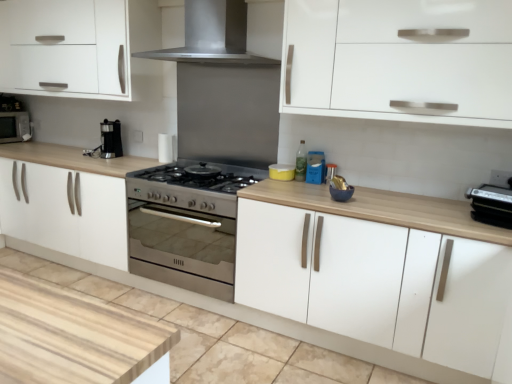
I want to click on metallic silver toaster at center, the 2th appliance positioned from the right, so click(x=330, y=172).

Describe the element at coordinates (330, 172) in the screenshot. I see `metallic silver toaster at center, which ranks as the 2th appliance in back-to-front order` at that location.

Measure the distance between white matte cabinet at lower center, arranged as the 2th cabinetry when viewed from the right, and camera.

A distance of 1.99 meters exists between white matte cabinet at lower center, arranged as the 2th cabinetry when viewed from the right, and camera.

This screenshot has height=384, width=512. What do you see at coordinates (492, 204) in the screenshot?
I see `black plastic toaster at right, positioned as the third appliance in left-to-right order` at bounding box center [492, 204].

Identify the location of white matte cabinet at center, which is the 2th cabinetry in left-to-right order. (377, 283).

Can we say metallic silver toaster at center, the 2th appliance positioned from the right, lies outside white matte cabinet at lower center, the 1th cabinetry from the left?

Yes, metallic silver toaster at center, the 2th appliance positioned from the right, is located beyond the bounds of white matte cabinet at lower center, the 1th cabinetry from the left.

Would you say metallic silver toaster at center, which is the second appliance from left to right, is a long distance from white matte cabinet at lower center, arranged as the 2th cabinetry when viewed from the right?

No, metallic silver toaster at center, which is the second appliance from left to right, is not far away from white matte cabinet at lower center, arranged as the 2th cabinetry when viewed from the right.

Is metallic silver toaster at center, which is the second appliance from left to right, taller or shorter than white matte cabinet at lower center, the 1th cabinetry from the left?

Clearly, metallic silver toaster at center, which is the second appliance from left to right, is taller compared to white matte cabinet at lower center, the 1th cabinetry from the left.

How many degrees apart are the facing directions of stainless steel range hood at upper center and black plastic toaster at right, positioned as the third appliance in left-to-right order?

They differ by 16.1 degrees in their facing directions.

Is point (146, 56) behind point (494, 221)?

Yes, point (146, 56) is behind point (494, 221).

Which of these two, stainless steel range hood at upper center or black plastic toaster at right, placed as the third appliance when sorted from back to front, stands taller?

With more height is stainless steel range hood at upper center.

Do you think stainless steel range hood at upper center is within black plastic toaster at right, positioned as the third appliance in left-to-right order, or outside of it?

The correct answer is: outside.

Between matte black microwave at left and stainless steel range hood at upper center, which one appears on the right side from the viewer's perspective?

From the viewer's perspective, stainless steel range hood at upper center appears more on the right side.

Considering the positions of objects matte black microwave at left and stainless steel range hood at upper center in the image provided, who is in front, matte black microwave at left or stainless steel range hood at upper center?

stainless steel range hood at upper center is more forward.

Considering the relative sizes of matte black microwave at left and stainless steel range hood at upper center in the image provided, is matte black microwave at left wider than stainless steel range hood at upper center?

No, matte black microwave at left is not wider than stainless steel range hood at upper center.

From a real-world perspective, which is physically above, matte black microwave at left or stainless steel range hood at upper center?

stainless steel range hood at upper center.

Is white matte cabinet at center, which is the 2th cabinetry in left-to-right order, located within matte black microwave at left?

That's incorrect, white matte cabinet at center, which is the 2th cabinetry in left-to-right order, is not inside matte black microwave at left.

Locate an element on the screen. This screenshot has height=384, width=512. microwave that is behind the white matte cabinet at center, which is the 2th cabinetry in left-to-right order is located at coordinates (14, 127).

Considering the relative sizes of matte black microwave at left and white matte cabinet at center, the first cabinetry positioned from the right, in the image provided, is matte black microwave at left smaller than white matte cabinet at center, the first cabinetry positioned from the right,?

Correct, matte black microwave at left occupies less space than white matte cabinet at center, the first cabinetry positioned from the right.

Is yellow matte container at center, which is the 1th appliance from back to front, far away from white matte cabinet at lower center, the 1th cabinetry from the left?

No, there isn't a large distance between yellow matte container at center, which is the 1th appliance from back to front, and white matte cabinet at lower center, the 1th cabinetry from the left.

From the picture: Is yellow matte container at center, the 3th appliance positioned from the front, at the right side of white matte cabinet at lower center, arranged as the 2th cabinetry when viewed from the right?

Yes, yellow matte container at center, the 3th appliance positioned from the front, is to the right of white matte cabinet at lower center, arranged as the 2th cabinetry when viewed from the right.

The width and height of the screenshot is (512, 384). In order to click on cabinetry on the left side of yellow matte container at center, marked as the 1th appliance in a left-to-right arrangement in this screenshot , I will do `click(282, 322)`.

Does black plastic toaster at right, which is the first appliance in right-to-left order, contain white matte cabinet at center, which is the 2th cabinetry in left-to-right order?

No, white matte cabinet at center, which is the 2th cabinetry in left-to-right order, is located outside of black plastic toaster at right, which is the first appliance in right-to-left order.

From the image's perspective, which object appears higher, black plastic toaster at right, placed as the third appliance when sorted from back to front, or white matte cabinet at center, which is the 2th cabinetry in left-to-right order?

From the image's view, black plastic toaster at right, placed as the third appliance when sorted from back to front, is above.

Can you tell me how much black plastic toaster at right, which is the first appliance in right-to-left order, and white matte cabinet at center, which is the 2th cabinetry in left-to-right order, differ in facing direction?

The angle between the facing direction of black plastic toaster at right, which is the first appliance in right-to-left order, and the facing direction of white matte cabinet at center, which is the 2th cabinetry in left-to-right order, is 16.3 degrees.

Find the location of `the 1st cabinetry counting from the left of the black plastic toaster at right, placed as the third appliance when sorted from back to front`. the 1st cabinetry counting from the left of the black plastic toaster at right, placed as the third appliance when sorted from back to front is located at coordinates (377, 283).

Considering the sizes of white matte cabinet at center, the first cabinetry positioned from the right, and stainless steel oven at center in the image, is white matte cabinet at center, the first cabinetry positioned from the right, bigger or smaller than stainless steel oven at center?

white matte cabinet at center, the first cabinetry positioned from the right, is bigger than stainless steel oven at center.

Is white matte cabinet at center, which is the 2th cabinetry in left-to-right order, oriented away from stainless steel oven at center?

white matte cabinet at center, which is the 2th cabinetry in left-to-right order, is not turned away from stainless steel oven at center.

From the image's perspective, is white matte cabinet at center, the first cabinetry positioned from the right, located above or below stainless steel oven at center?

Based on their image positions, white matte cabinet at center, the first cabinetry positioned from the right, is located beneath stainless steel oven at center.

Is the depth of white matte cabinet at center, which is the 2th cabinetry in left-to-right order, less than that of stainless steel oven at center?

Yes, white matte cabinet at center, which is the 2th cabinetry in left-to-right order, is in front of stainless steel oven at center.

From the image's perspective, count 2nd cabinetrys downward from the metallic silver toaster at center, marked as the second appliance in a front-to-back arrangement, and point to it. Please provide its 2D coordinates.

[(282, 322)]

This screenshot has height=384, width=512. Find the location of `home appliance above the black plastic toaster at right, arranged as the 1th appliance when viewed from the front (from a real-world perspective)`. home appliance above the black plastic toaster at right, arranged as the 1th appliance when viewed from the front (from a real-world perspective) is located at coordinates (213, 35).

From the image, which object appears to be farther from white matte cabinet at center, the first cabinetry positioned from the right, metallic silver toaster at center, the 2th appliance positioned from the right, or stainless steel oven at center?

The object further to white matte cabinet at center, the first cabinetry positioned from the right, is metallic silver toaster at center, the 2th appliance positioned from the right.

Estimate the real-world distances between objects in this image. Which object is further from white matte cabinet at lower center, arranged as the 2th cabinetry when viewed from the right, black plastic toaster at right, positioned as the third appliance in left-to-right order, or stainless steel oven at center?

stainless steel oven at center.

Based on their spatial positions, is yellow matte container at center, marked as the 1th appliance in a left-to-right arrangement, or metallic silver toaster at center, the 2th appliance positioned from the right, further from stainless steel range hood at upper center?

metallic silver toaster at center, the 2th appliance positioned from the right, is further to stainless steel range hood at upper center.

Estimate the real-world distances between objects in this image. Which object is closer to white matte cabinet at center, which is the 2th cabinetry in left-to-right order, stainless steel oven at center or metallic silver toaster at center, which is the second appliance from left to right?

stainless steel oven at center is closer to white matte cabinet at center, which is the 2th cabinetry in left-to-right order.

Looking at this image, when comparing their distances from stainless steel oven at center, does white matte cabinet at lower center, the 1th cabinetry from the left, or stainless steel range hood at upper center seem closer?

white matte cabinet at lower center, the 1th cabinetry from the left, lies closer to stainless steel oven at center than the other object.

Looking at the image, which one is located further to black plastic toaster at right, positioned as the third appliance in left-to-right order, metallic silver toaster at center, the 2th appliance positioned from the right, or stainless steel range hood at upper center?

Among the two, stainless steel range hood at upper center is located further to black plastic toaster at right, positioned as the third appliance in left-to-right order.

When comparing their distances from white matte cabinet at center, the first cabinetry positioned from the right, does stainless steel oven at center or black plastic toaster at right, positioned as the third appliance in left-to-right order, seem closer?

Based on the image, black plastic toaster at right, positioned as the third appliance in left-to-right order, appears to be nearer to white matte cabinet at center, the first cabinetry positioned from the right.

Looking at the image, which one is located further to yellow matte container at center, which is the 1th appliance from back to front, stainless steel range hood at upper center or white matte cabinet at center, the first cabinetry positioned from the right?

Among the two, stainless steel range hood at upper center is located further to yellow matte container at center, which is the 1th appliance from back to front.

I want to click on cabinetry between matte black microwave at left and metallic silver toaster at center, the 2th appliance positioned from the right, from left to right, so click(282, 322).

The width and height of the screenshot is (512, 384). I want to click on home appliance between white matte cabinet at lower center, arranged as the 2th cabinetry when viewed from the right, and black plastic toaster at right, arranged as the 1th appliance when viewed from the front, from left to right, so click(x=213, y=35).

At what (x,y) coordinates should I click in order to perform the action: click on oven between matte black microwave at left and metallic silver toaster at center, which is the second appliance from left to right, from left to right. Please return your answer as a coordinate pair (x, y). Image resolution: width=512 pixels, height=384 pixels. Looking at the image, I should click on (182, 248).

You are a GUI agent. You are given a task and a screenshot of the screen. Output one action in this format:
    pyautogui.click(x=<x>, y=<y>)
    Task: Click on the cabinetry located between matte black microwave at left and yellow matte container at center, which appears as the third appliance when viewed from the right, in the left-right direction
    The width and height of the screenshot is (512, 384).
    Given the screenshot: What is the action you would take?
    pyautogui.click(x=282, y=322)